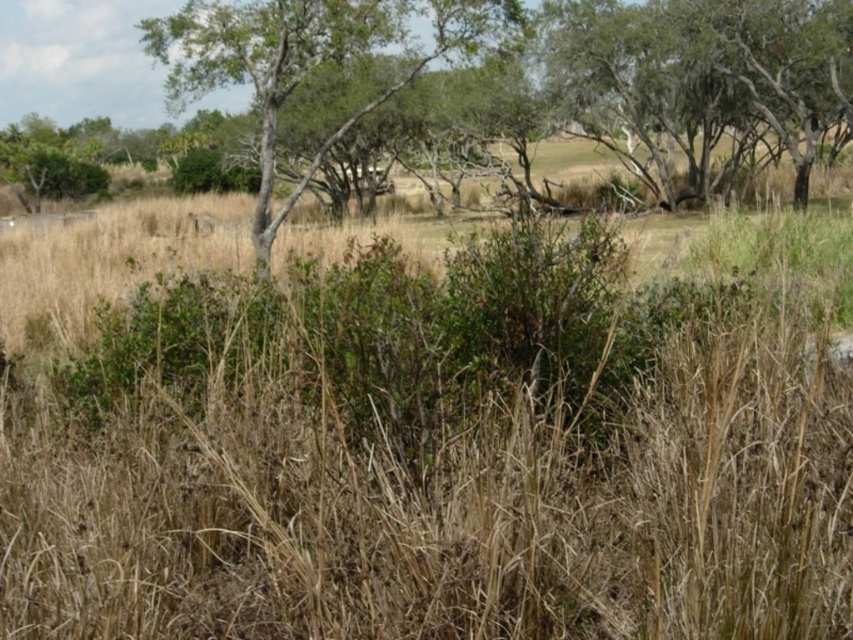
Question: Does green rough bark tree at upper right appear on the right side of green leafy tree at center?

Choices:
 (A) yes
 (B) no

Answer: (A)

Question: Which object is farther from the camera taking this photo?

Choices:
 (A) green rough bark tree at upper right
 (B) green leafy tree at center

Answer: (A)

Question: Among these points, which one is nearest to the camera?

Choices:
 (A) [x=267, y=120]
 (B) [x=692, y=113]

Answer: (A)

Question: Is green rough bark tree at upper right positioned at the back of green leafy tree at center?

Choices:
 (A) yes
 (B) no

Answer: (A)

Question: Can you confirm if green rough bark tree at upper right is smaller than green leafy tree at center?

Choices:
 (A) yes
 (B) no

Answer: (A)

Question: Which point is closer to the camera?

Choices:
 (A) green leafy tree at center
 (B) green rough bark tree at upper right

Answer: (A)